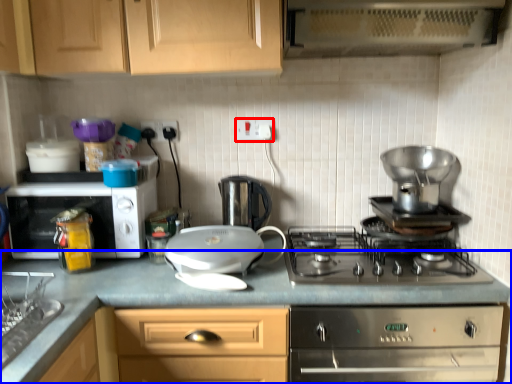
Question: Which point is closer to the camera, electric outlet (highlighted by a red box) or countertop (highlighted by a blue box)?

Choices:
 (A) electric outlet
 (B) countertop

Answer: (B)